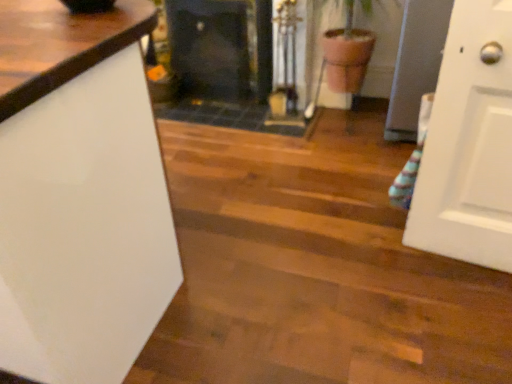
The height and width of the screenshot is (384, 512). Describe the element at coordinates (223, 67) in the screenshot. I see `black glass fireplace at center, the 1th fireplace from the right` at that location.

Where is `black glass fireplace at center, arranged as the 2th fireplace when viewed from the right`? black glass fireplace at center, arranged as the 2th fireplace when viewed from the right is located at coordinates (221, 47).

Based on the photo, from the image's perspective, is black glass fireplace at center, the 1th fireplace from the right, above white glossy countertop at left?

Correct, black glass fireplace at center, the 1th fireplace from the right, appears higher than white glossy countertop at left in the image.

Between black glass fireplace at center, the 1th fireplace from the right, and white glossy countertop at left, which one is positioned in front?

white glossy countertop at left is in front.

Is black glass fireplace at center, the second fireplace viewed from the left, shorter than white glossy countertop at left?

Yes, black glass fireplace at center, the second fireplace viewed from the left, is shorter than white glossy countertop at left.

From a real-world perspective, is black glass fireplace at center, the 1th fireplace from the right, on white glossy countertop at left?

No, from a real-world perspective, black glass fireplace at center, the 1th fireplace from the right, is not above white glossy countertop at left.

From their relative heights in the image, would you say black glass fireplace at center, arranged as the 2th fireplace when viewed from the right, is taller or shorter than white glossy countertop at left?

Considering their sizes, black glass fireplace at center, arranged as the 2th fireplace when viewed from the right, has less height than white glossy countertop at left.

How much distance is there between black glass fireplace at center, which ranks as the first fireplace in left-to-right order, and white glossy countertop at left?

6.05 feet.

Based on the photo, does black glass fireplace at center, arranged as the 2th fireplace when viewed from the right, turn towards white glossy countertop at left?

Yes, black glass fireplace at center, arranged as the 2th fireplace when viewed from the right, is turned towards white glossy countertop at left.

Which is nearer, (x=262, y=60) or (x=108, y=123)?

Point (x=108, y=123)

Is black glass fireplace at center, arranged as the 2th fireplace when viewed from the right, at the back of white glossy countertop at left?

No, black glass fireplace at center, arranged as the 2th fireplace when viewed from the right, is not at the back of white glossy countertop at left.

Consider the image. From the image's perspective, is white glossy countertop at left under black glass fireplace at center, arranged as the 2th fireplace when viewed from the right?

Yes.

How many degrees apart are the facing directions of white glossy countertop at left and black glass fireplace at center, arranged as the 2th fireplace when viewed from the right?

The facing directions of white glossy countertop at left and black glass fireplace at center, arranged as the 2th fireplace when viewed from the right, are 180 degrees apart.

Considering the relative sizes of white glossy countertop at left and black glass fireplace at center, which ranks as the first fireplace in left-to-right order, in the image provided, is white glossy countertop at left taller than black glass fireplace at center, which ranks as the first fireplace in left-to-right order,?

Correct, white glossy countertop at left is much taller as black glass fireplace at center, which ranks as the first fireplace in left-to-right order.

Identify the location of countertop located in front of the black glass fireplace at center, the 1th fireplace from the right. This screenshot has height=384, width=512. (79, 194).

Does white glossy countertop at left have a smaller size compared to black glass fireplace at center, the second fireplace viewed from the left?

Actually, white glossy countertop at left might be larger than black glass fireplace at center, the second fireplace viewed from the left.

Who is taller, white glossy countertop at left or black glass fireplace at center, the second fireplace viewed from the left?

Standing taller between the two is white glossy countertop at left.

From the picture: From a real-world perspective, is black glass fireplace at center, the 1th fireplace from the right, physically below black glass fireplace at center, arranged as the 2th fireplace when viewed from the right?

No, from a real-world perspective, black glass fireplace at center, the 1th fireplace from the right, is not below black glass fireplace at center, arranged as the 2th fireplace when viewed from the right.

Would you say black glass fireplace at center, the second fireplace viewed from the left, is to the left or to the right of black glass fireplace at center, arranged as the 2th fireplace when viewed from the right, in the picture?

Clearly, black glass fireplace at center, the second fireplace viewed from the left, is on the right of black glass fireplace at center, arranged as the 2th fireplace when viewed from the right, in the image.

From the image's perspective, which is below, black glass fireplace at center, the 1th fireplace from the right, or black glass fireplace at center, which ranks as the first fireplace in left-to-right order?

black glass fireplace at center, the 1th fireplace from the right, from the image's perspective.

Is point (271, 12) closer or farther from the camera than point (208, 95)?

Point (271, 12) is closer to the camera than point (208, 95).

Consider the image. Could you tell me if black glass fireplace at center, arranged as the 2th fireplace when viewed from the right, is turned towards black glass fireplace at center, the 1th fireplace from the right?

Yes.

Considering the sizes of black glass fireplace at center, arranged as the 2th fireplace when viewed from the right, and black glass fireplace at center, the 1th fireplace from the right, in the image, is black glass fireplace at center, arranged as the 2th fireplace when viewed from the right, taller or shorter than black glass fireplace at center, the 1th fireplace from the right,?

In the image, black glass fireplace at center, arranged as the 2th fireplace when viewed from the right, appears to be shorter than black glass fireplace at center, the 1th fireplace from the right.

Can you see black glass fireplace at center, which ranks as the first fireplace in left-to-right order, touching black glass fireplace at center, the second fireplace viewed from the left?

Yes, black glass fireplace at center, which ranks as the first fireplace in left-to-right order, is touching black glass fireplace at center, the second fireplace viewed from the left.

Considering the sizes of objects black glass fireplace at center, which ranks as the first fireplace in left-to-right order, and black glass fireplace at center, the 1th fireplace from the right, in the image provided, who is smaller, black glass fireplace at center, which ranks as the first fireplace in left-to-right order, or black glass fireplace at center, the 1th fireplace from the right,?

black glass fireplace at center, which ranks as the first fireplace in left-to-right order.

Starting from the white glossy countertop at left, which fireplace is the 1st one behind? Please provide its 2D coordinates.

[(223, 67)]

Where is `countertop lying on the left of black glass fireplace at center, arranged as the 2th fireplace when viewed from the right`? This screenshot has width=512, height=384. countertop lying on the left of black glass fireplace at center, arranged as the 2th fireplace when viewed from the right is located at coordinates (79, 194).

Estimate the real-world distances between objects in this image. Which object is further from white glossy countertop at left, black glass fireplace at center, which ranks as the first fireplace in left-to-right order, or black glass fireplace at center, the 1th fireplace from the right?

black glass fireplace at center, which ranks as the first fireplace in left-to-right order, lies further to white glossy countertop at left than the other object.

From the image, which object appears to be nearer to black glass fireplace at center, arranged as the 2th fireplace when viewed from the right, black glass fireplace at center, the 1th fireplace from the right, or white glossy countertop at left?

black glass fireplace at center, the 1th fireplace from the right.

From the image, which object appears to be farther from white glossy countertop at left, black glass fireplace at center, the second fireplace viewed from the left, or black glass fireplace at center, arranged as the 2th fireplace when viewed from the right?

black glass fireplace at center, arranged as the 2th fireplace when viewed from the right, lies further to white glossy countertop at left than the other object.

When comparing their distances from black glass fireplace at center, arranged as the 2th fireplace when viewed from the right, does white glossy countertop at left or black glass fireplace at center, the 1th fireplace from the right, seem closer?

black glass fireplace at center, the 1th fireplace from the right.

Estimate the real-world distances between objects in this image. Which object is further from black glass fireplace at center, the second fireplace viewed from the left, white glossy countertop at left or black glass fireplace at center, arranged as the 2th fireplace when viewed from the right?

The object further to black glass fireplace at center, the second fireplace viewed from the left, is white glossy countertop at left.

Which object lies nearer to the anchor point black glass fireplace at center, the 1th fireplace from the right, black glass fireplace at center, arranged as the 2th fireplace when viewed from the right, or white glossy countertop at left?

black glass fireplace at center, arranged as the 2th fireplace when viewed from the right, is positioned closer to the anchor black glass fireplace at center, the 1th fireplace from the right.

Where is `fireplace between white glossy countertop at left and black glass fireplace at center, arranged as the 2th fireplace when viewed from the right, from front to back`? The height and width of the screenshot is (384, 512). fireplace between white glossy countertop at left and black glass fireplace at center, arranged as the 2th fireplace when viewed from the right, from front to back is located at coordinates (223, 67).